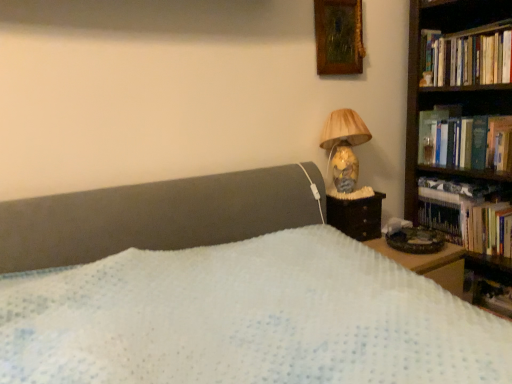
Question: Is dark wood nightstand at right facing towards hardcover books at right, which ranks as the third book in top-to-bottom order?

Choices:
 (A) no
 (B) yes

Answer: (A)

Question: Is dark wood nightstand at right thinner than hardcover books at right, which ranks as the third book in top-to-bottom order?

Choices:
 (A) yes
 (B) no

Answer: (A)

Question: Is hardcover books at right, which appears as the first book when ordered from the bottom, completely or partially inside dark wood nightstand at right?

Choices:
 (A) yes
 (B) no

Answer: (B)

Question: From a real-world perspective, is dark wood nightstand at right located higher than hardcover books at right, which appears as the first book when ordered from the bottom?

Choices:
 (A) yes
 (B) no

Answer: (A)

Question: Is dark wood nightstand at right bigger than hardcover books at right, which ranks as the third book in top-to-bottom order?

Choices:
 (A) yes
 (B) no

Answer: (B)

Question: Does dark wood nightstand at right appear on the left side of hardcover books at right, which ranks as the third book in top-to-bottom order?

Choices:
 (A) yes
 (B) no

Answer: (A)

Question: Is hardcover book at upper right completely or partially outside of hardcover books at right, which is the third book in bottom-to-top order?

Choices:
 (A) no
 (B) yes

Answer: (B)

Question: Does hardcover book at upper right have a smaller size compared to hardcover books at right, positioned as the 1th book in top-to-bottom order?

Choices:
 (A) yes
 (B) no

Answer: (A)

Question: Is hardcover book at upper right in contact with hardcover books at right, positioned as the 1th book in top-to-bottom order?

Choices:
 (A) no
 (B) yes

Answer: (A)

Question: Is hardcover books at right, positioned as the 1th book in top-to-bottom order, surrounded by hardcover book at upper right?

Choices:
 (A) yes
 (B) no

Answer: (B)

Question: Considering the relative positions of hardcover book at upper right and hardcover books at right, which is the third book in bottom-to-top order, in the image provided, is hardcover book at upper right to the left of hardcover books at right, which is the third book in bottom-to-top order, from the viewer's perspective?

Choices:
 (A) yes
 (B) no

Answer: (A)

Question: Can you confirm if hardcover book at upper right is bigger than hardcover books at right, positioned as the 1th book in top-to-bottom order?

Choices:
 (A) yes
 (B) no

Answer: (B)

Question: Is wooden bookshelf at right behind hardcover books at right, which is the third book in bottom-to-top order?

Choices:
 (A) no
 (B) yes

Answer: (B)